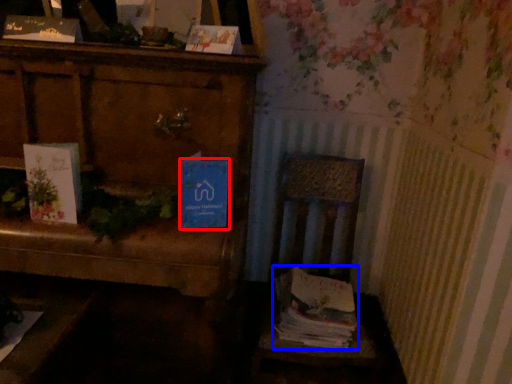
Question: Among these objects, which one is farthest to the camera, paperback book (highlighted by a red box) or magazine (highlighted by a blue box)?

Choices:
 (A) paperback book
 (B) magazine

Answer: (B)